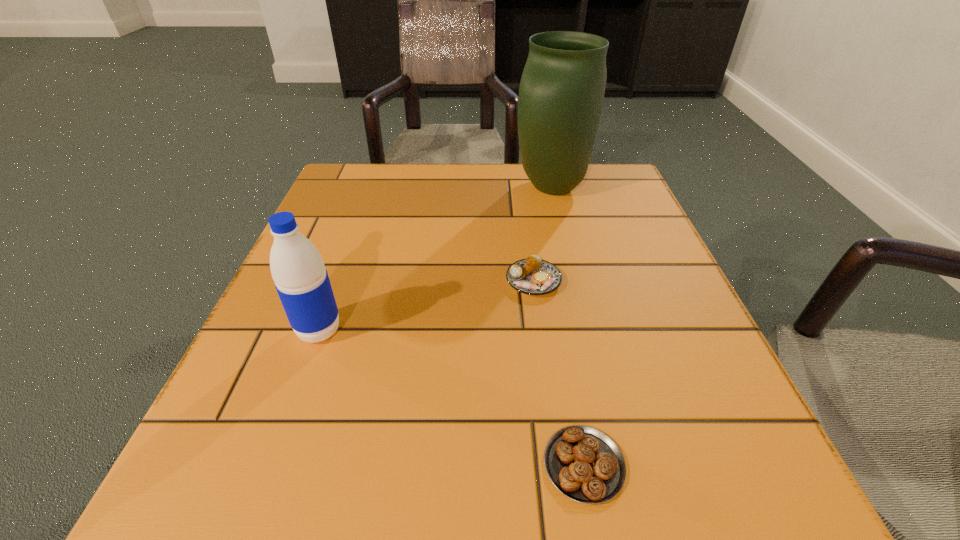
At what (x,y) coordinates should I click in order to perform the action: click on vase. Please return your answer as a coordinate pair (x, y). The image size is (960, 540). Looking at the image, I should click on (561, 93).

The image size is (960, 540). I want to click on the tallest object, so click(561, 93).

Identify the location of the leftmost object. (301, 280).

The width and height of the screenshot is (960, 540). Identify the location of water bottle. (301, 280).

Where is `the second farthest object`? the second farthest object is located at coordinates click(533, 276).

Image resolution: width=960 pixels, height=540 pixels. I want to click on the farther pastry, so click(533, 276).

The image size is (960, 540). What are the coordinates of `the nearest object` in the screenshot? It's located at (584, 464).

In order to click on the shorter pastry in this screenshot , I will do `click(584, 464)`.

Where is `free region located 0.330m on the left of the vase`? The height and width of the screenshot is (540, 960). free region located 0.330m on the left of the vase is located at coordinates (372, 187).

Identify the location of free region located 0.110m on the front of the third shortest object. (289, 413).